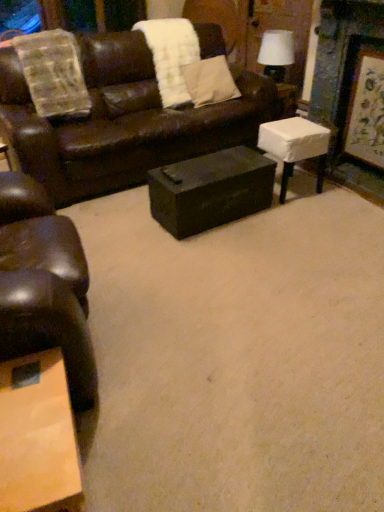
Question: Should I look upward or downward to see white fluffy blanket at upper center?

Choices:
 (A) down
 (B) up

Answer: (B)

Question: Is wooden coffee table at lower left positioned in front of beige fabric pillow at upper center?

Choices:
 (A) yes
 (B) no

Answer: (A)

Question: Can you confirm if wooden coffee table at lower left is positioned to the left of beige fabric pillow at upper center?

Choices:
 (A) yes
 (B) no

Answer: (A)

Question: Is wooden coffee table at lower left turned away from beige fabric pillow at upper center?

Choices:
 (A) no
 (B) yes

Answer: (A)

Question: Does wooden coffee table at lower left have a lesser height compared to beige fabric pillow at upper center?

Choices:
 (A) no
 (B) yes

Answer: (A)

Question: Is wooden coffee table at lower left smaller than beige fabric pillow at upper center?

Choices:
 (A) yes
 (B) no

Answer: (B)

Question: Is wooden coffee table at lower left positioned far away from beige fabric pillow at upper center?

Choices:
 (A) yes
 (B) no

Answer: (A)

Question: From a real-world perspective, does matte black trunk at center, positioned as the 1th table in left-to-right order, sit lower than beige fabric pillow at upper center?

Choices:
 (A) no
 (B) yes

Answer: (B)

Question: Is beige fabric pillow at upper center at the back of matte black trunk at center, the second table when ordered from right to left?

Choices:
 (A) no
 (B) yes

Answer: (A)

Question: Is matte black trunk at center, positioned as the 1th table in left-to-right order, facing towards beige fabric pillow at upper center?

Choices:
 (A) no
 (B) yes

Answer: (A)

Question: Is matte black trunk at center, positioned as the 1th table in left-to-right order, further to the viewer compared to beige fabric pillow at upper center?

Choices:
 (A) no
 (B) yes

Answer: (A)

Question: Considering the relative sizes of matte black trunk at center, the second table when ordered from right to left, and beige fabric pillow at upper center in the image provided, is matte black trunk at center, the second table when ordered from right to left, shorter than beige fabric pillow at upper center?

Choices:
 (A) yes
 (B) no

Answer: (A)

Question: Is matte black trunk at center, positioned as the 1th table in left-to-right order, next to beige fabric pillow at upper center?

Choices:
 (A) no
 (B) yes

Answer: (A)

Question: Can you confirm if white fabric-covered stool at right, the 1th table viewed from the right, is bigger than white fluffy blanket at upper center?

Choices:
 (A) yes
 (B) no

Answer: (B)